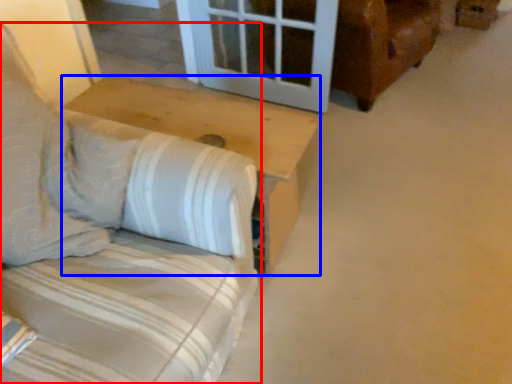
Question: Among these objects, which one is farthest to the camera, furniture (highlighted by a red box) or table (highlighted by a blue box)?

Choices:
 (A) furniture
 (B) table

Answer: (B)